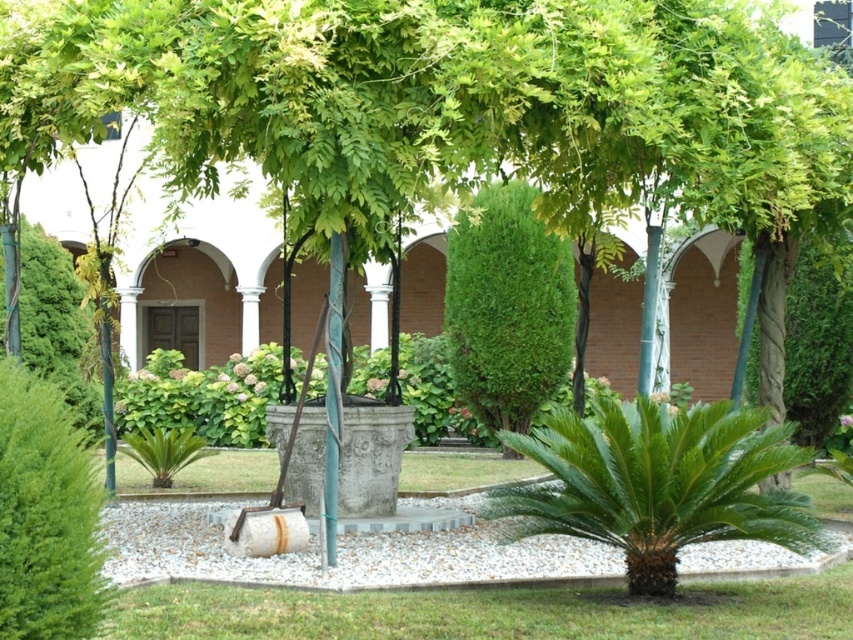
Question: Does white gravel at center appear on the left side of green textured bush at center?

Choices:
 (A) yes
 (B) no

Answer: (A)

Question: Does white gravel at center appear on the right side of green leafy bush at left?

Choices:
 (A) no
 (B) yes

Answer: (B)

Question: Among these points, which one is farthest from the camera?

Choices:
 (A) (415, 536)
 (B) (839, 339)

Answer: (B)

Question: Which object appears closest to the camera in this image?

Choices:
 (A) green leafy bush at lower left
 (B) white gravel at center
 (C) green leafy bush at left
 (D) green leafy bush at center

Answer: (A)

Question: Which of the following is the closest to the observer?

Choices:
 (A) (65, 262)
 (B) (793, 352)
 (C) (49, 454)

Answer: (C)

Question: Can you confirm if green leafy palm at center is positioned below green leafy bush at left?

Choices:
 (A) no
 (B) yes

Answer: (B)